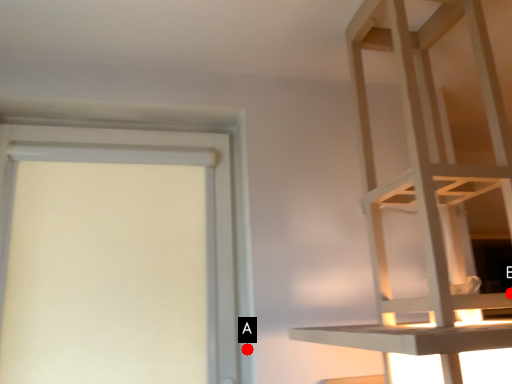
Question: Two points are circled on the image, labeled by A and B beside each circle. Which point is farther to the camera?

Choices:
 (A) A is further
 (B) B is further

Answer: (B)